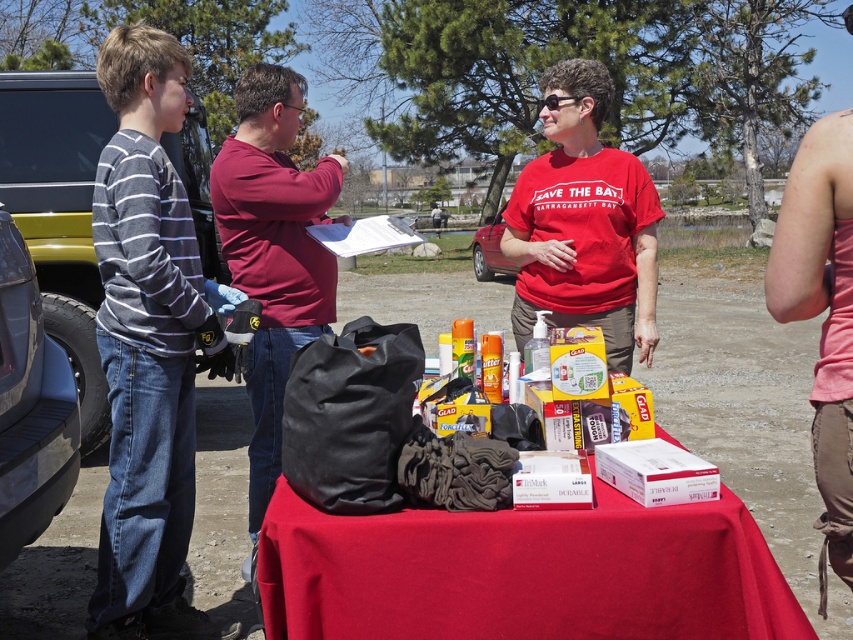
Looking at this image, is rubberized black bag at center below maroon cotton shirt at center?

Yes.

Is rubberized black bag at center wider than maroon cotton shirt at center?

Indeed, rubberized black bag at center has a greater width compared to maroon cotton shirt at center.

In order to click on rubberized black bag at center in this screenshot , I will do `click(524, 572)`.

Find the location of a particular element. rubberized black bag at center is located at coordinates (524, 572).

Can you confirm if matte red t-shirt at center is positioned to the right of pink fabric tank top at center?

Incorrect, matte red t-shirt at center is not on the right side of pink fabric tank top at center.

From the picture: Can you confirm if matte red t-shirt at center is positioned above pink fabric tank top at center?

Yes.

At what (x,y) coordinates should I click in order to perform the action: click on matte red t-shirt at center. Please return your answer as a coordinate pair (x, y). This screenshot has height=640, width=853. Looking at the image, I should click on (584, 221).

Can you confirm if gray striped sweater at left is positioned to the right of maroon cotton shirt at center?

No, gray striped sweater at left is not to the right of maroon cotton shirt at center.

Can you confirm if gray striped sweater at left is bigger than maroon cotton shirt at center?

Actually, gray striped sweater at left might be smaller than maroon cotton shirt at center.

Who is more forward, (149, 257) or (254, 72)?

Point (149, 257) is in front.

The width and height of the screenshot is (853, 640). What are the coordinates of `gray striped sweater at left` in the screenshot? It's located at (148, 344).